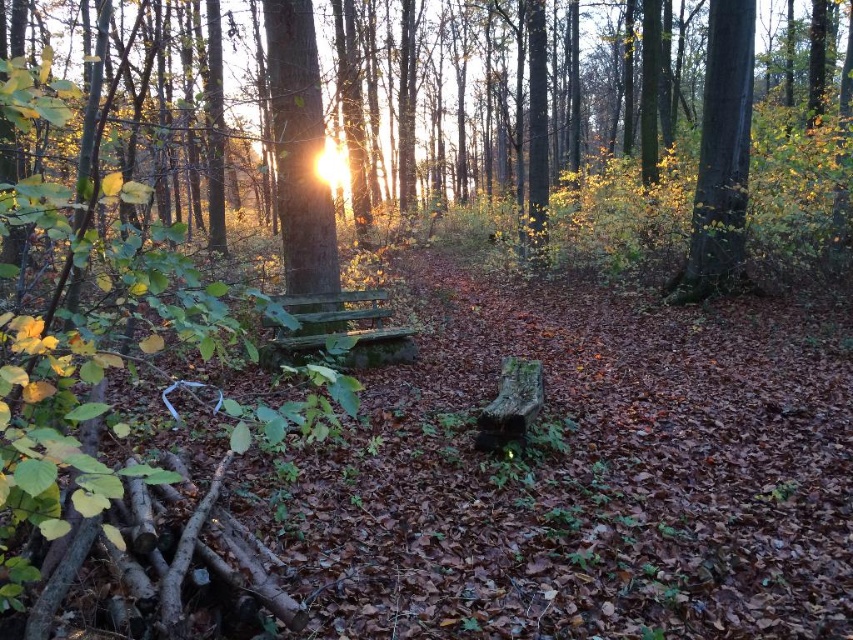
You are standing at the center of the forest and want to find the smooth brown tree trunk at center. According to the coordinates provided, where exactly is the smooth brown tree trunk located?

The smooth brown tree trunk at center is located at coordinates point (299, 154).

You are standing in the forest and want to take a photo of both the smooth brown tree trunk at center and the smooth bark tree at upper right. Which tree should you focus on first to ensure both are in the frame?

You should focus on the smooth brown tree trunk at center first because it is closer to you than the smooth bark tree at upper right, ensuring both are in the frame.